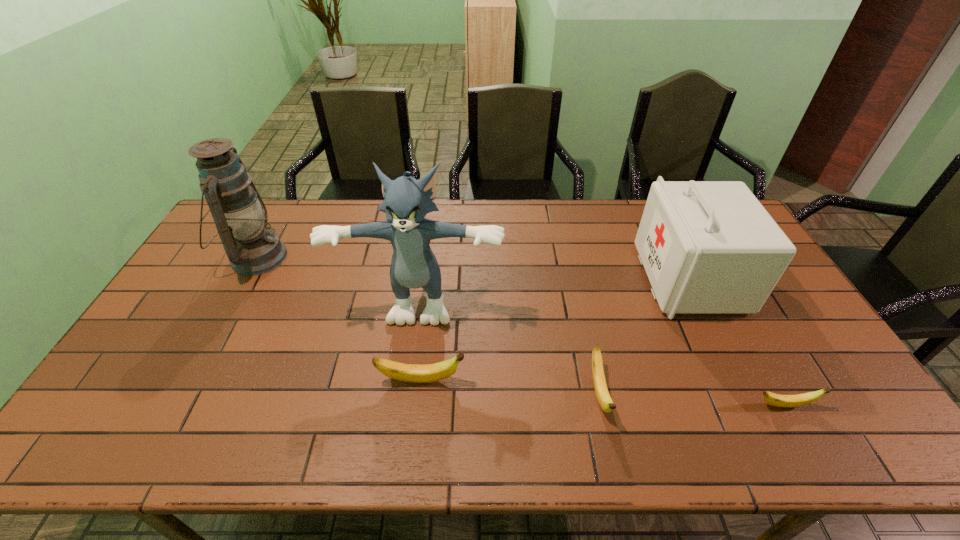
Find the location of a particular element. Image resolution: width=960 pixels, height=540 pixels. free point that keeps the bananas evenly spaced on the left is located at coordinates (252, 368).